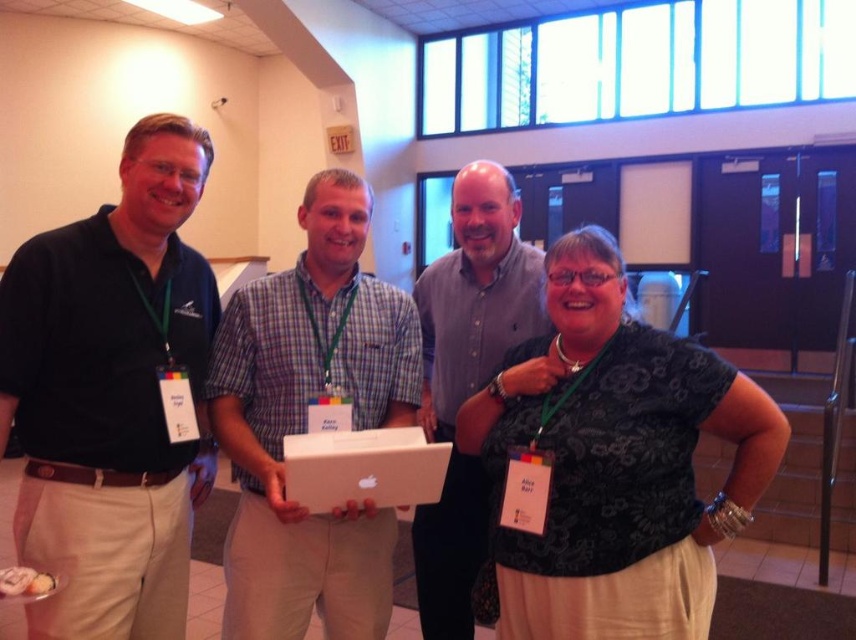
Question: Does matte gray shirt at center lie in front of white cardboard box at center?

Choices:
 (A) yes
 (B) no

Answer: (B)

Question: Which point is farther to the camera?

Choices:
 (A) plaid cotton shirt at center
 (B) matte black polo shirt at left
 (C) white cardboard box at center
 (D) black floral blouse at center

Answer: (A)

Question: Which object is positioned closest to the matte gray shirt at center?

Choices:
 (A) white cardboard box at center
 (B) plaid cotton shirt at center
 (C) black floral blouse at center

Answer: (B)

Question: Which point is closer to the camera taking this photo?

Choices:
 (A) (122, 557)
 (B) (428, 506)

Answer: (A)

Question: Does matte black polo shirt at left appear under black floral blouse at center?

Choices:
 (A) no
 (B) yes

Answer: (A)

Question: Can you confirm if matte gray shirt at center is positioned below white cardboard box at center?

Choices:
 (A) no
 (B) yes

Answer: (A)